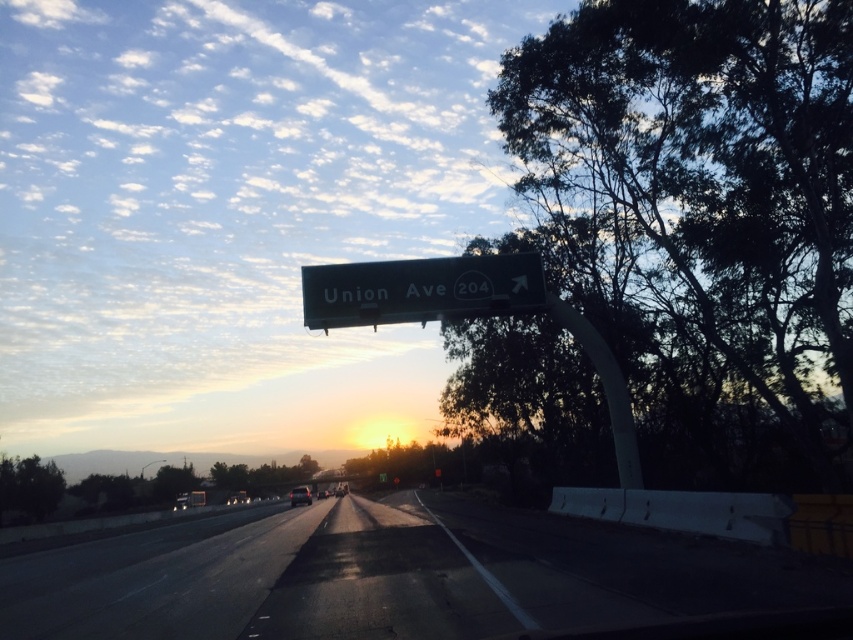
You are sitting in the front passenger seat of the vehicle. You notice two points marked on the road ahead. Which point, point (762, 566) or point (289, 499), is closer to you?

Point (762, 566) is closer to the camera than point (289, 499), so it is closer to you.

You are driving a car and see the black asphalt highway at center and the green metallic sign at center ahead. Which one is located to the right side of the other?

The black asphalt highway at center is positioned on the right side of green metallic sign at center.